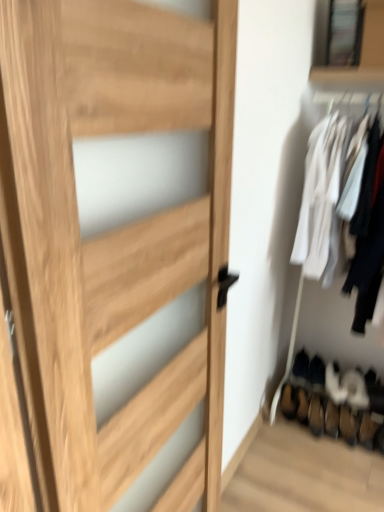
Image resolution: width=384 pixels, height=512 pixels. I want to click on free space above white suede shoe at lower right, placed as the fourth shoe when sorted from left to right (from a real-world perspective), so click(x=357, y=379).